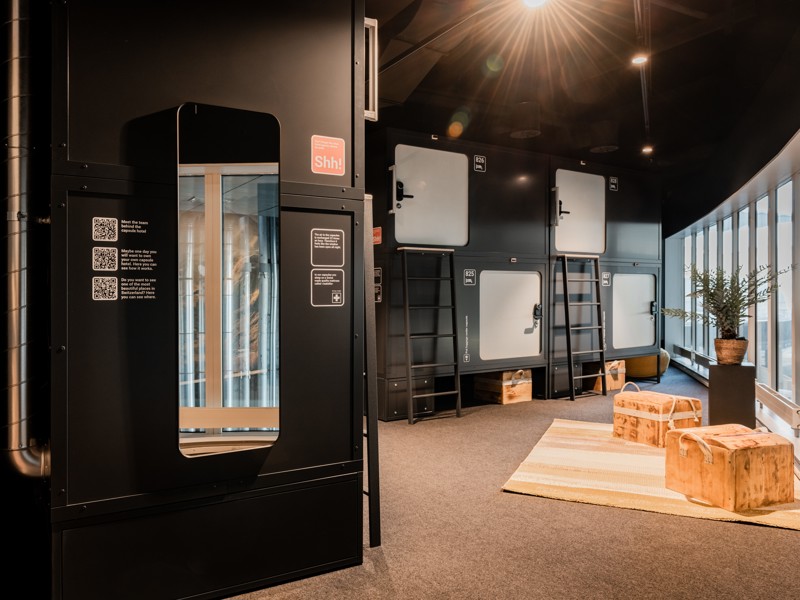
Identify the location of handle. This screenshot has width=800, height=600. click(x=402, y=193), click(x=536, y=312), click(x=562, y=208), click(x=652, y=309).